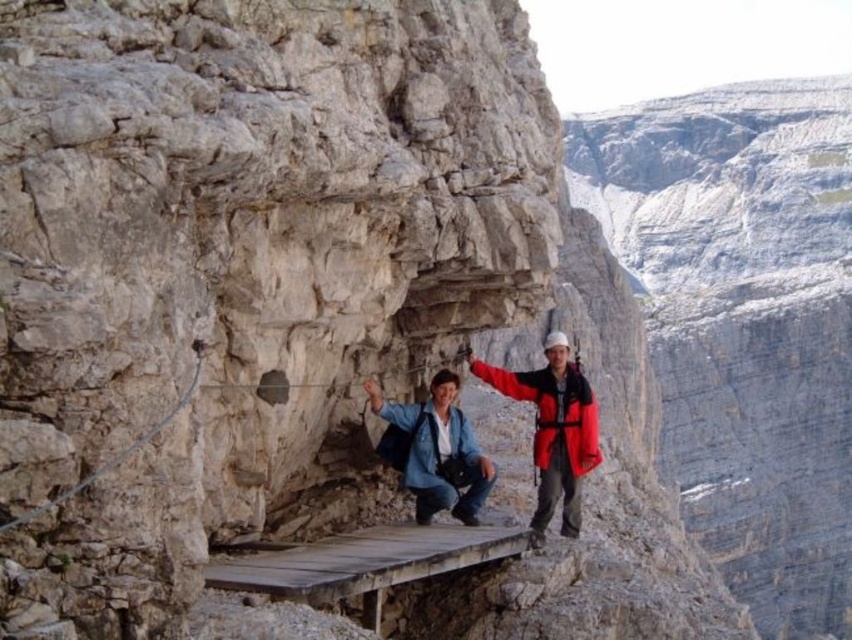
Question: Among these objects, which one is farthest from the camera?

Choices:
 (A) wooden bridge at center
 (B) denim jacket at center
 (C) matte blue jacket at center

Answer: (C)

Question: Does gray rock cliff at right have a larger size compared to matte blue jacket at center?

Choices:
 (A) yes
 (B) no

Answer: (A)

Question: Which point appears closest to the camera in this image?

Choices:
 (A) (427, 538)
 (B) (744, 145)

Answer: (A)

Question: Which is nearer to the gray rock cliff at right?

Choices:
 (A) matte blue jacket at center
 (B) wooden bridge at center

Answer: (B)

Question: Is matte blue jacket at center behind wooden bridge at center?

Choices:
 (A) no
 (B) yes

Answer: (B)

Question: Where is matte blue jacket at center located in relation to denim jacket at center in the image?

Choices:
 (A) right
 (B) left

Answer: (A)